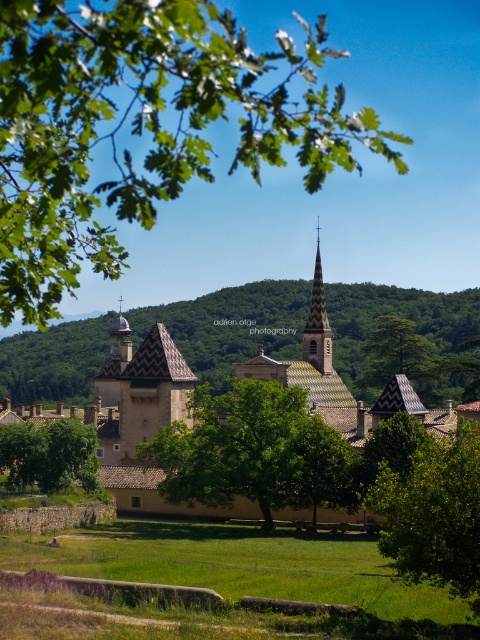
Question: Among these objects, which one is nearest to the camera?

Choices:
 (A) brown checkered spire at center
 (B) green leafy branch at upper left
 (C) green textured tree at center

Answer: (B)

Question: Which object appears closest to the camera in this image?

Choices:
 (A) green textured tree at center
 (B) green leafy branch at upper left
 (C) green leafy tree at center

Answer: (B)

Question: Can you confirm if green leafy tree at lower left is smaller than brown checkered spire at center?

Choices:
 (A) no
 (B) yes

Answer: (B)

Question: Does green leafy tree at center appear on the left side of green leafy tree at lower right?

Choices:
 (A) yes
 (B) no

Answer: (A)

Question: Does green leafy tree at lower right have a larger size compared to green leafy tree at lower left?

Choices:
 (A) no
 (B) yes

Answer: (B)

Question: Which of these objects is positioned closest to the green leafy tree at lower left?

Choices:
 (A) green leafy branch at upper left
 (B) green leafy tree at lower right
 (C) green textured tree at center
 (D) brown checkered spire at center

Answer: (B)